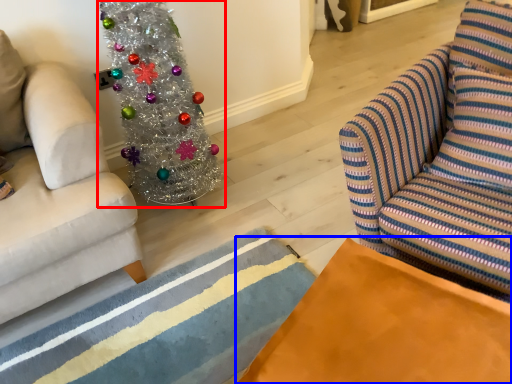
Question: Which of the following is the closest to the observer, christmas tree (highlighted by a red box) or table (highlighted by a blue box)?

Choices:
 (A) christmas tree
 (B) table

Answer: (B)